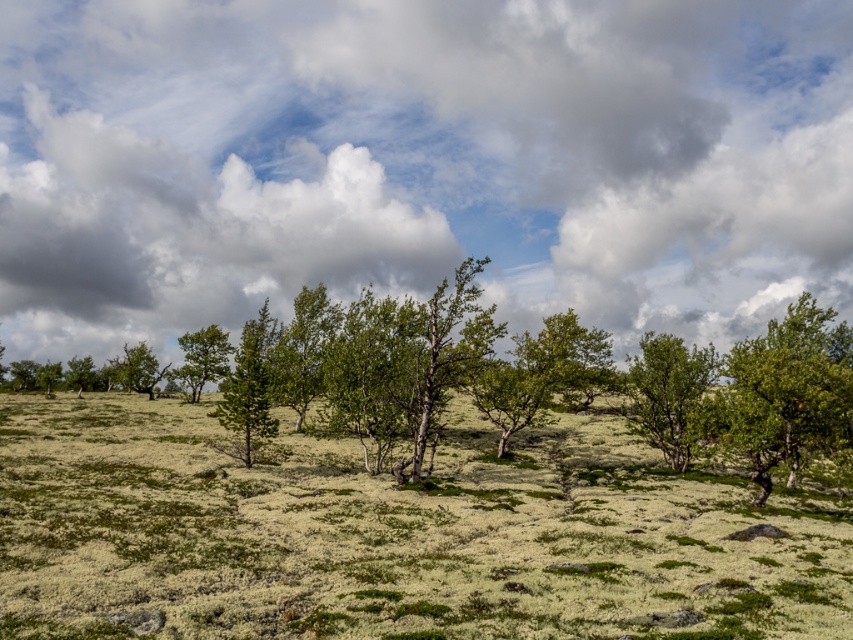
You are navigating through the landscape and want to reach the point at coordinates point [625,310]. You are currently at point [224,349]. Given the terrain described, which direction should you move to reach your destination?

Since point [625,310] is behind point [224,349], you should move in the direction away from the current position to reach the destination.

You are standing in the middle of the open land in the scene. There are two points marked on the ground. One is at point (759, 493) and the other at point (115, 364). Which point is closer to you?

Point (759, 493) is in front of point (115, 364), so the point closer to you is point (759, 493).

You are a hiker trying to navigate through this landscape. You need to find a tree that can provide more shade. Which tree should you choose between the green leafy tree at right and the green matte tree at left?

The green leafy tree at right has a larger size compared to the green matte tree at left, so it would provide more shade.